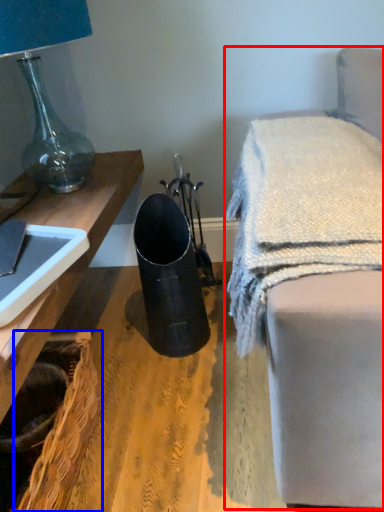
Question: Which of the following is the farthest to the observer, furniture (highlighted by a red box) or basket (highlighted by a blue box)?

Choices:
 (A) furniture
 (B) basket

Answer: (B)